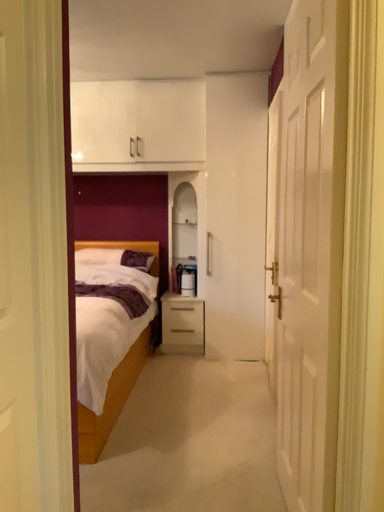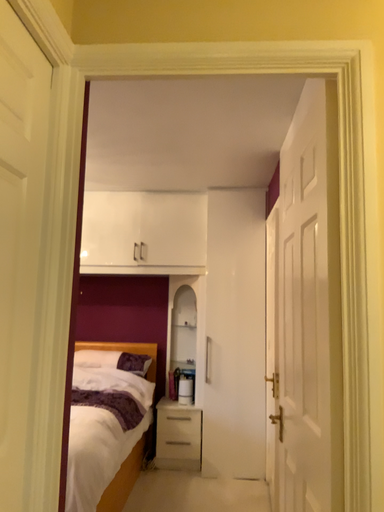
Question: Which way did the camera rotate in the video?

Choices:
 (A) rotated downward
 (B) rotated upward

Answer: (B)